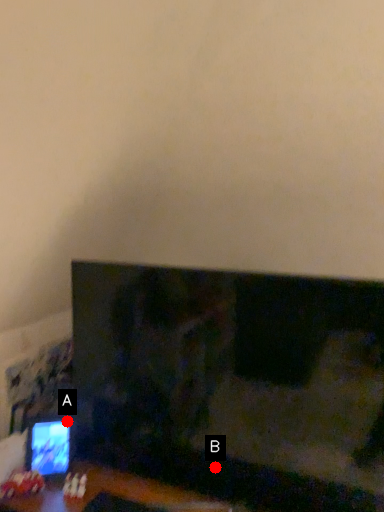
Question: Two points are circled on the image, labeled by A and B beside each circle. Which point is closer to the camera taking this photo?

Choices:
 (A) A is closer
 (B) B is closer

Answer: (B)